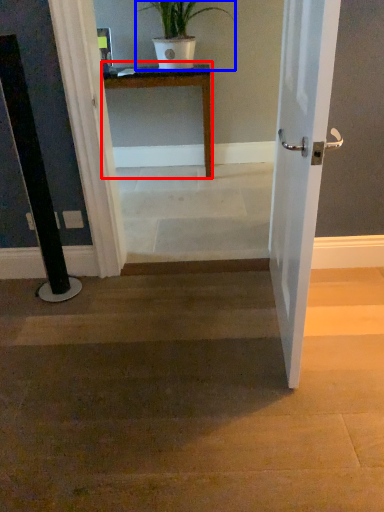
Question: Which of the following is the farthest to the observer, table (highlighted by a red box) or houseplant (highlighted by a blue box)?

Choices:
 (A) table
 (B) houseplant

Answer: (A)